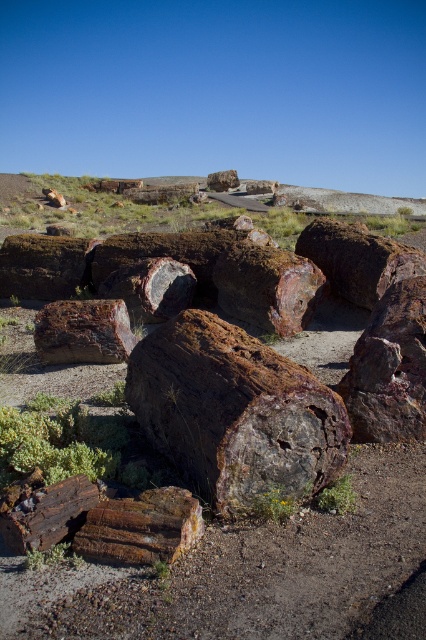
At what (x,y) coordinates should I click in order to perform the action: click on brown polished petrified wood at center. Please return your answer as a coordinate pair (x, y). Looking at the image, I should click on (235, 412).

Is brown polished petrified wood at center below rusty wood log at lower left?

No, brown polished petrified wood at center is not below rusty wood log at lower left.

Image resolution: width=426 pixels, height=640 pixels. Describe the element at coordinates (235, 412) in the screenshot. I see `brown polished petrified wood at center` at that location.

At what (x,y) coordinates should I click in order to perform the action: click on brown polished petrified wood at center. Please return your answer as a coordinate pair (x, y). Looking at the image, I should click on (235, 412).

The height and width of the screenshot is (640, 426). Identify the location of rusty wood logs at center. (253, 573).

Does rusty wood logs at center have a greater height compared to brown polished petrified wood at center?

Indeed, rusty wood logs at center has a greater height compared to brown polished petrified wood at center.

What do you see at coordinates (253, 573) in the screenshot? I see `rusty wood logs at center` at bounding box center [253, 573].

You are a GUI agent. You are given a task and a screenshot of the screen. Output one action in this format:
    pyautogui.click(x=<x>, y=<y>)
    Task: Click on the rusty wood logs at center
    The image size is (426, 640).
    Given the screenshot: What is the action you would take?
    pyautogui.click(x=253, y=573)

Which is in front, point (155, 608) or point (63, 440)?

Point (155, 608) is in front.

Between point (371, 516) and point (75, 422), which one is positioned in front?

Point (371, 516) is more forward.

The width and height of the screenshot is (426, 640). I want to click on rusty wood logs at center, so click(253, 573).